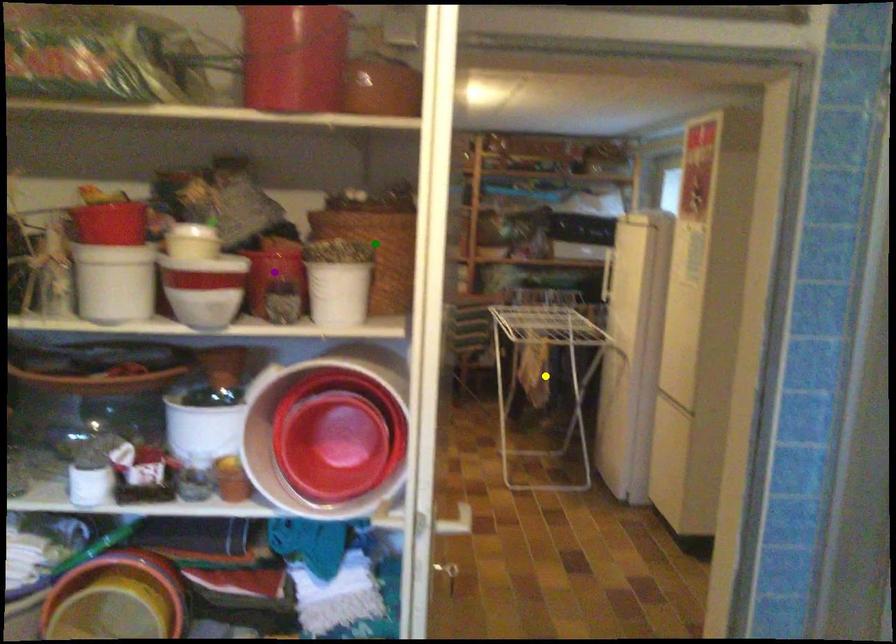
Order these from nearest to farthest:
A) yellow point
B) purple point
C) green point

green point < purple point < yellow point